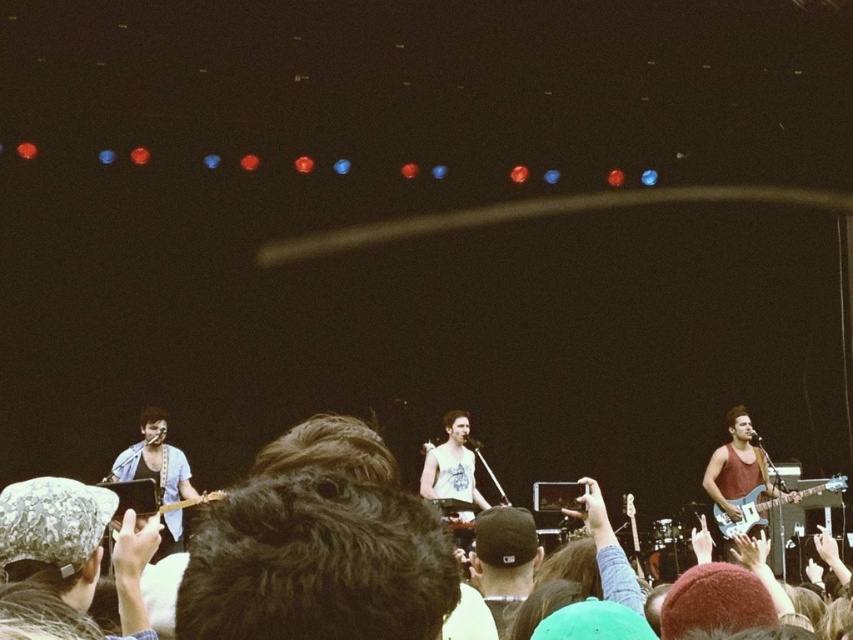
You are a photographer at the concert and you want to take a photo of the black fabric cap at center. Where exactly should you focus your camera?

You should focus your camera at point [503,557] to capture the black fabric cap at center.

You are a photographer at the concert. You want to capture a photo that includes both the black fabric cap at center and the matte electric guitar at right. Which object will appear larger in the photo?

The matte electric guitar at right will appear larger in the photo because it is taller than the black fabric cap at center.

You are a photographer standing at the front of the stage. You notice two points marked in the image. One is at point coordinates point (735, 502) and the other at point coordinates point (207, 500). Which point is closer to your camera lens?

Point (207, 500) is closer to the camera lens because the description states that point (735, 502) is further to the camera than point (207, 500).